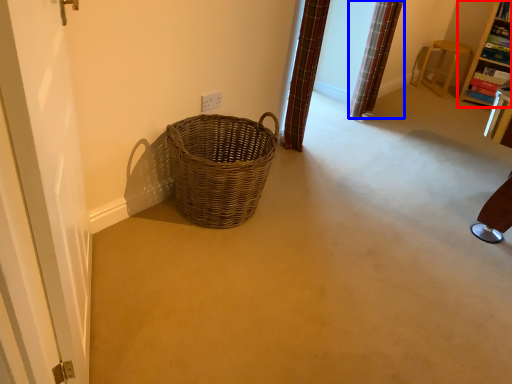
Question: Which object is further to the camera taking this photo, furniture (highlighted by a red box) or curtain (highlighted by a blue box)?

Choices:
 (A) furniture
 (B) curtain

Answer: (A)